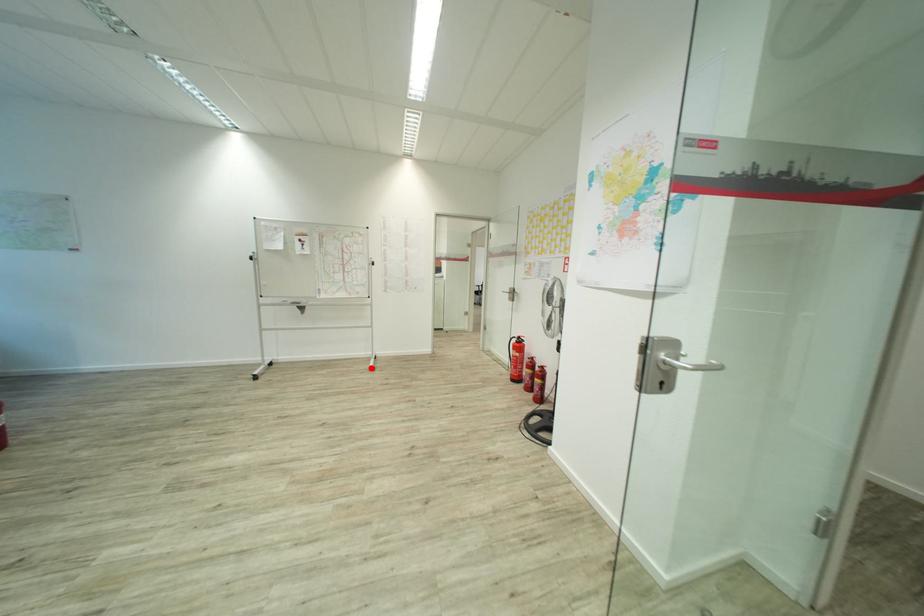
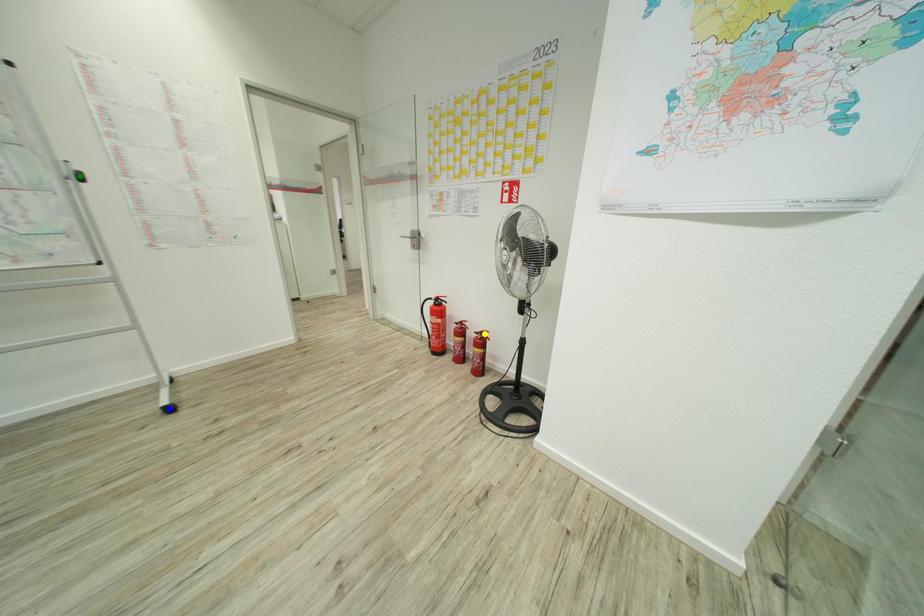
Question: I am providing you with two images of the same scene from different viewpoints. A red point is marked on the first image. You are given multiple points on the second image. Which point in image 2 represents the same 3d spot as the red point in image 1?

Choices:
 (A) green point
 (B) blue point
 (C) yellow point

Answer: (B)